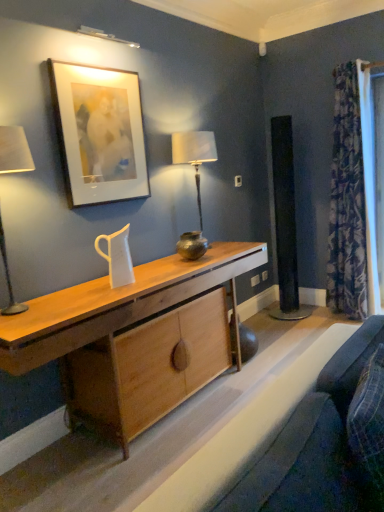
Where is `unoccupied region to the right of shiny metallic vase at center`? The height and width of the screenshot is (512, 384). unoccupied region to the right of shiny metallic vase at center is located at coordinates (220, 257).